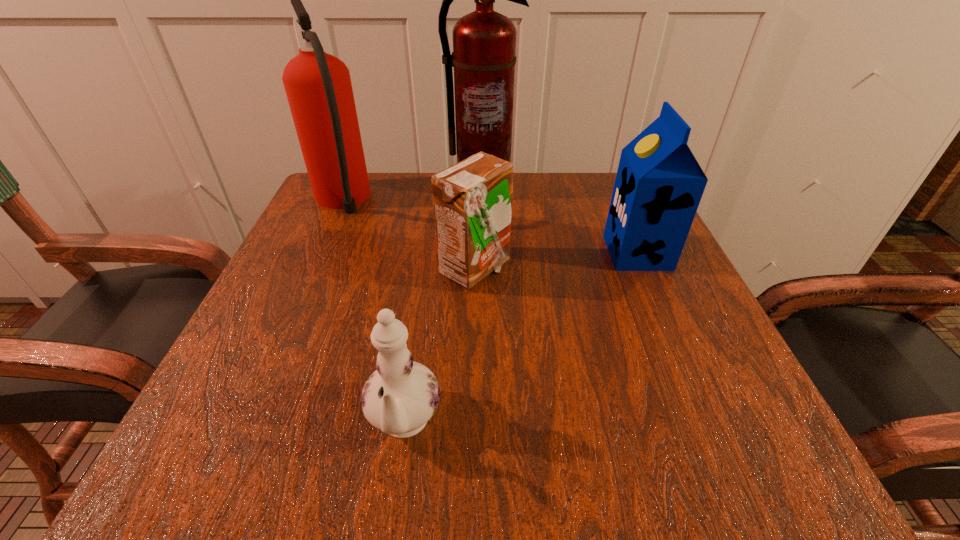
Find the location of a particular element. Image resolution: width=960 pixels, height=540 pixels. vacant space in between the right fire extinguisher and the chinaware is located at coordinates (444, 306).

I want to click on empty location between the leftmost object and the right fire extinguisher, so click(412, 194).

Locate an element on the screen. vacant area that lies between the shorter carton and the chinaware is located at coordinates (439, 347).

The height and width of the screenshot is (540, 960). I want to click on vacant region between the right fire extinguisher and the chinaware, so click(444, 306).

Locate an element on the screen. This screenshot has height=540, width=960. free space between the right fire extinguisher and the chinaware is located at coordinates (444, 306).

Locate an element on the screen. free space between the left fire extinguisher and the shorter carton is located at coordinates (408, 235).

At what (x,y) coordinates should I click in order to perform the action: click on free area in between the right fire extinguisher and the chinaware. Please return your answer as a coordinate pair (x, y). The width and height of the screenshot is (960, 540). Looking at the image, I should click on (444, 306).

The height and width of the screenshot is (540, 960). Identify the location of vacant space in between the leftmost object and the shorter carton. (408, 235).

Choose which object is the third nearest neighbor to the shorter carton. Please provide its 2D coordinates. Your answer should be formatted as a tuple, i.e. [(x, y)], where the tuple contains the x and y coordinates of a point satisfying the conditions above.

[(399, 398)]

Locate an element on the screen. This screenshot has width=960, height=540. object that is the nearest to the left fire extinguisher is located at coordinates (484, 42).